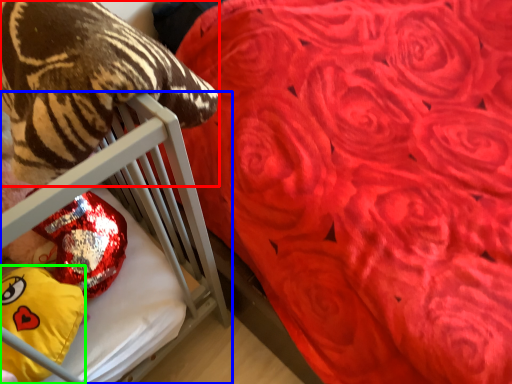
Question: Estimate the real-world distances between objects in this image. Which object is farther from animal (highlighted by a red box), furniture (highlighted by a blue box) or throw pillow (highlighted by a green box)?

Choices:
 (A) furniture
 (B) throw pillow

Answer: (B)